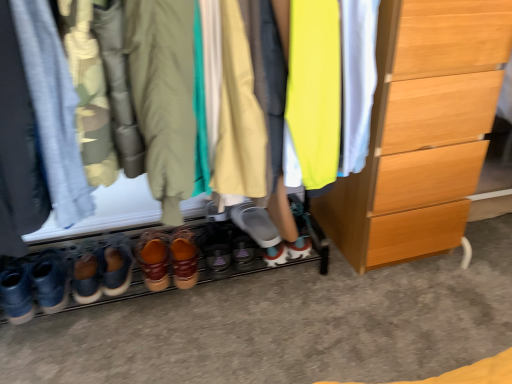
Question: Which direction should I rotate to look at neon yellow fabric at center, which is counted as the 1th clothing, starting from the right?

Choices:
 (A) right
 (B) left

Answer: (A)

Question: Considering the relative sizes of leather brown shoes at center, which is counted as the 3th footwear, starting from the left, and leather-like brown shoes at center, arranged as the second footwear when viewed from the right, in the image provided, is leather brown shoes at center, which is counted as the 3th footwear, starting from the left, bigger than leather-like brown shoes at center, arranged as the second footwear when viewed from the right,?

Choices:
 (A) yes
 (B) no

Answer: (A)

Question: From the image's perspective, does leather brown shoes at center, which is counted as the 3th footwear, starting from the left, appear lower than leather-like brown shoes at center, arranged as the second footwear when viewed from the right?

Choices:
 (A) yes
 (B) no

Answer: (A)

Question: Considering the relative positions of leather brown shoes at center, which appears as the 4th footwear when viewed from the right, and leather-like brown shoes at center, placed as the 5th footwear when sorted from left to right, in the image provided, is leather brown shoes at center, which appears as the 4th footwear when viewed from the right, behind leather-like brown shoes at center, placed as the 5th footwear when sorted from left to right,?

Choices:
 (A) no
 (B) yes

Answer: (A)

Question: From a real-world perspective, is leather brown shoes at center, which appears as the 4th footwear when viewed from the right, on top of leather-like brown shoes at center, placed as the 5th footwear when sorted from left to right?

Choices:
 (A) no
 (B) yes

Answer: (A)

Question: Is leather brown shoes at center, which appears as the 4th footwear when viewed from the right, in front of leather-like brown shoes at center, arranged as the second footwear when viewed from the right?

Choices:
 (A) no
 (B) yes

Answer: (B)

Question: From the image's perspective, is leather brown shoes at center, which appears as the 4th footwear when viewed from the right, above leather-like brown shoes at center, placed as the 5th footwear when sorted from left to right?

Choices:
 (A) no
 (B) yes

Answer: (A)

Question: Is leather boots at center, which is counted as the fourth footwear, starting from the left, beside khaki cotton jacket at center, which is counted as the 2th clothing, starting from the left?

Choices:
 (A) no
 (B) yes

Answer: (A)

Question: Is leather boots at center, which is counted as the fourth footwear, starting from the left, wider than khaki cotton jacket at center, which is counted as the 2th clothing, starting from the left?

Choices:
 (A) no
 (B) yes

Answer: (A)

Question: Is leather boots at center, the 3th footwear when ordered from right to left, positioned with its back to khaki cotton jacket at center, which is counted as the 2th clothing, starting from the left?

Choices:
 (A) no
 (B) yes

Answer: (A)

Question: Considering the relative sizes of leather boots at center, which is counted as the fourth footwear, starting from the left, and khaki cotton jacket at center, which is the third clothing from right to left, in the image provided, is leather boots at center, which is counted as the fourth footwear, starting from the left, bigger than khaki cotton jacket at center, which is the third clothing from right to left,?

Choices:
 (A) no
 (B) yes

Answer: (A)

Question: Is leather boots at center, the 3th footwear when ordered from right to left, smaller than khaki cotton jacket at center, which is the third clothing from right to left?

Choices:
 (A) no
 (B) yes

Answer: (B)

Question: Does leather brown shoes at lower left, the 1th footwear viewed from the left, have a greater height compared to matte gray shoe at center, which is the 6th footwear in left-to-right order?

Choices:
 (A) yes
 (B) no

Answer: (A)